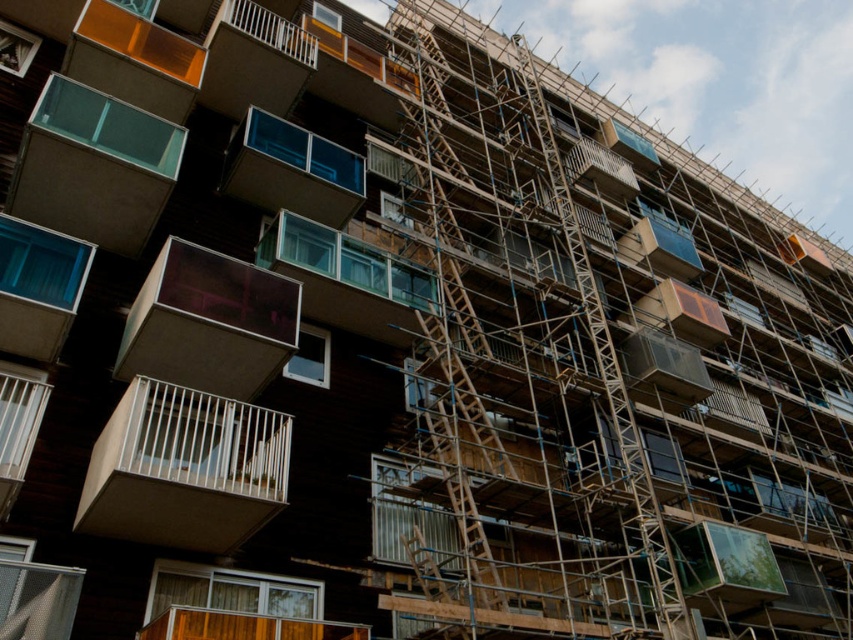
Question: Which point appears closest to the camera in this image?

Choices:
 (A) (190, 532)
 (B) (627, 445)
 (C) (329, 177)

Answer: (A)

Question: Does wooden scaffolding at center come behind translucent glass balcony at center?

Choices:
 (A) yes
 (B) no

Answer: (B)

Question: Is white matte balcony at center above wooden scaffolding at center?

Choices:
 (A) no
 (B) yes

Answer: (A)

Question: Does white matte balcony at center have a smaller size compared to wooden scaffolding at center?

Choices:
 (A) no
 (B) yes

Answer: (B)

Question: Among these objects, which one is farthest from the camera?

Choices:
 (A) white matte balcony at center
 (B) wooden scaffolding at center

Answer: (B)

Question: Which is nearer to the wooden scaffolding at center?

Choices:
 (A) translucent glass balcony at center
 (B) white matte balcony at center

Answer: (A)